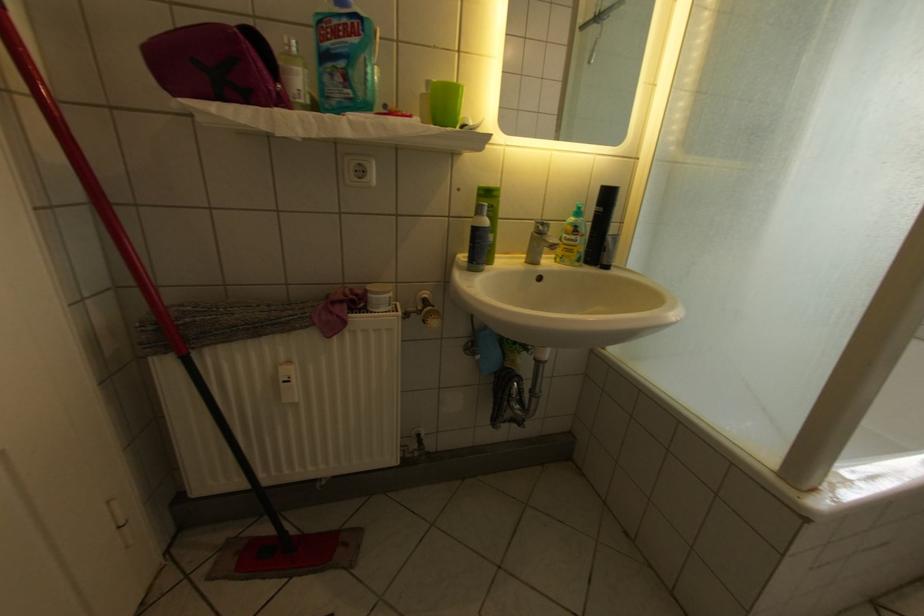
Which object does [214,65] point to?

It corresponds to the purple toiletry bag in the image.